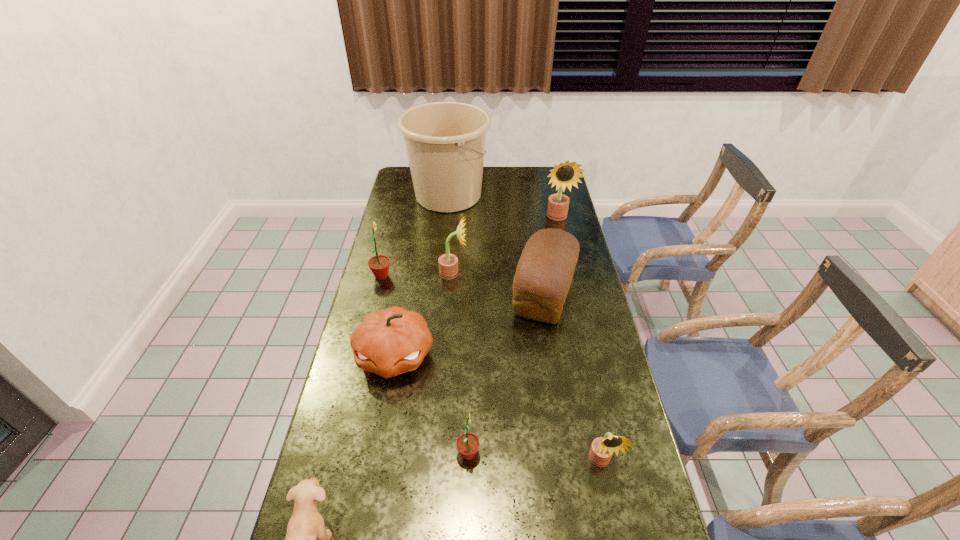
Locate an element on the screen. This screenshot has height=540, width=960. the tallest object is located at coordinates (445, 141).

Find the location of `bucket`. bucket is located at coordinates (445, 141).

In order to click on the biggest yellow sunflower in this screenshot , I will do `click(566, 173)`.

You are a GUI agent. You are given a task and a screenshot of the screen. Output one action in this format:
    pyautogui.click(x=<x>, y=<y>)
    Task: Click on the tallest sunflower
    This screenshot has height=540, width=960.
    Given the screenshot: What is the action you would take?
    pyautogui.click(x=566, y=173)

The width and height of the screenshot is (960, 540). I want to click on the leftmost yellow sunflower, so click(448, 263).

Image resolution: width=960 pixels, height=540 pixels. Find the location of `the second smallest yellow sunflower`. the second smallest yellow sunflower is located at coordinates (448, 263).

You are a GUI agent. You are given a task and a screenshot of the screen. Output one action in this format:
    pyautogui.click(x=<x>, y=<y>)
    Task: Click on the farther green sunflower
    Image resolution: width=960 pixels, height=540 pixels.
    Given the screenshot: What is the action you would take?
    pyautogui.click(x=379, y=264)

At what (x,y) coordinates should I click in order to perform the action: click on the left green sunflower. Please return your answer as a coordinate pair (x, y). The height and width of the screenshot is (540, 960). Looking at the image, I should click on (379, 264).

This screenshot has height=540, width=960. What are the coordinates of `bread` in the screenshot? It's located at (544, 273).

Identify the location of pumpkin. (392, 341).